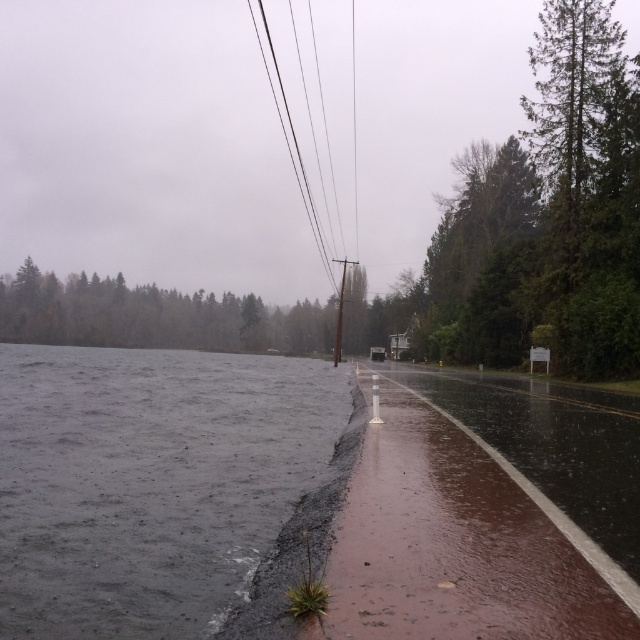
Question: Which point is farther to the camera?

Choices:
 (A) (269, 397)
 (B) (296, 168)

Answer: (B)

Question: Which of the following is the closest to the observer?

Choices:
 (A) (173, 614)
 (B) (301, 170)

Answer: (A)

Question: Which of the following is the closest to the observer?

Choices:
 (A) gray/rough water at lower left
 (B) black wire at upper center

Answer: (A)

Question: Does gray/rough water at lower left appear on the left side of black wire at upper center?

Choices:
 (A) no
 (B) yes

Answer: (A)

Question: Where is gray/rough water at lower left located in relation to black wire at upper center in the image?

Choices:
 (A) below
 (B) above

Answer: (A)

Question: In this image, where is gray/rough water at lower left located relative to black wire at upper center?

Choices:
 (A) left
 (B) right

Answer: (B)